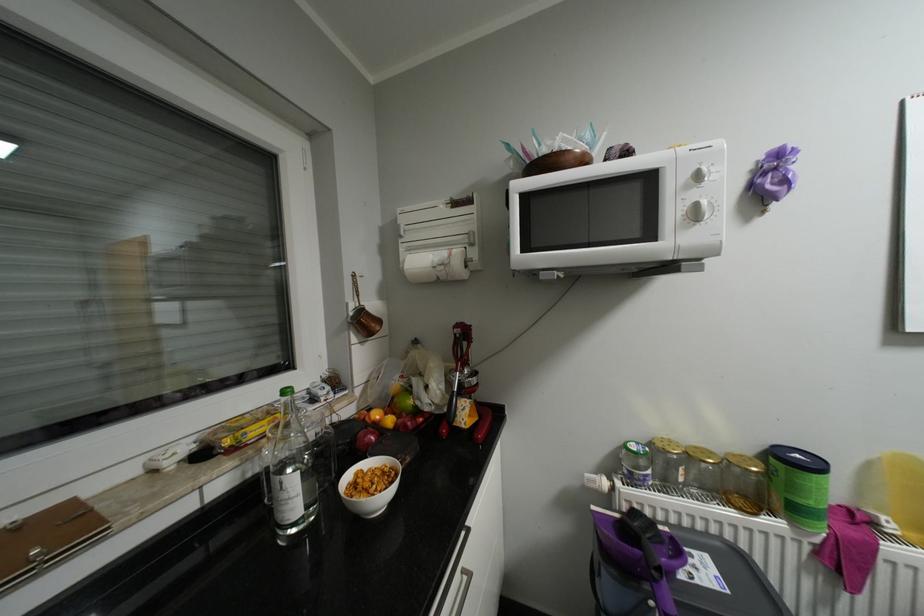
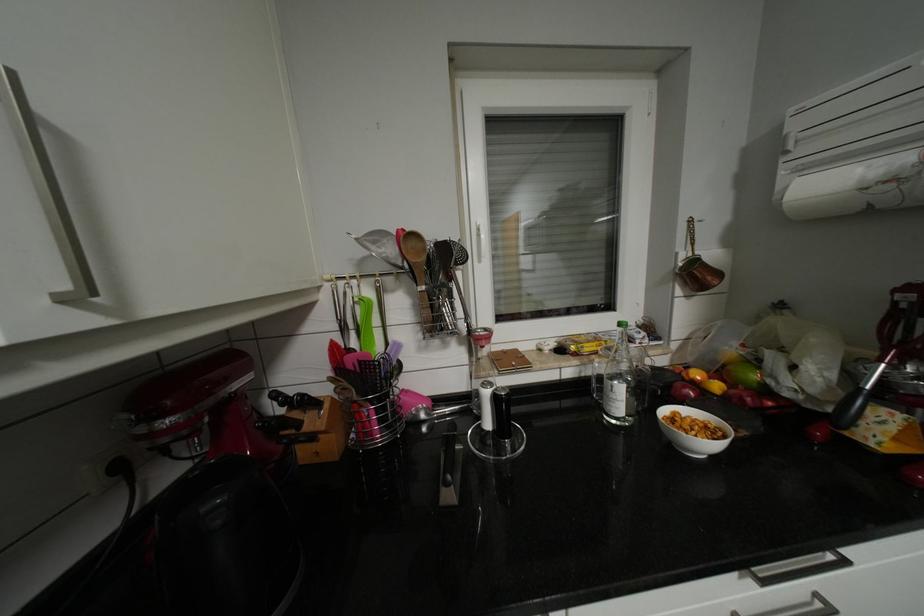
The point at (x=397, y=419) is marked in the first image. Where is the corresponding point in the second image?

(724, 386)